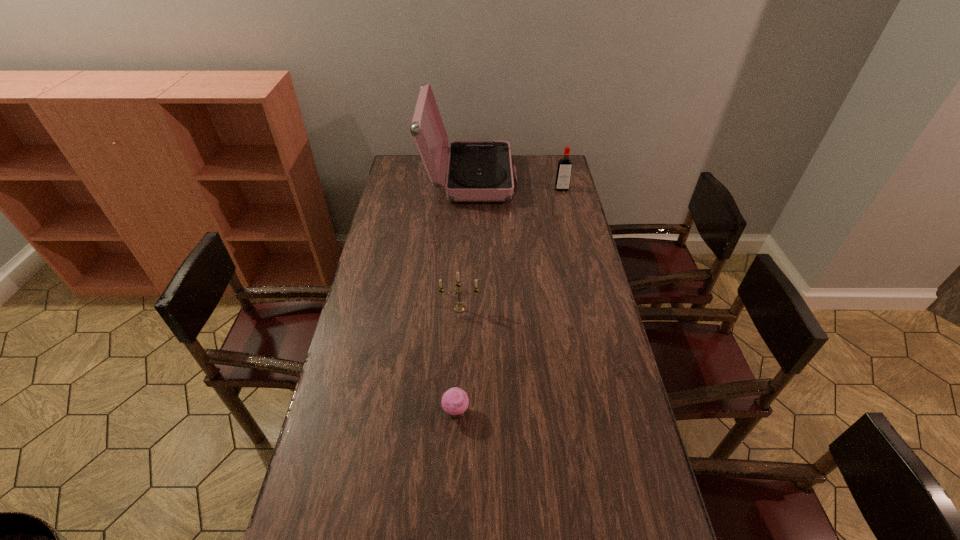
Identify the location of the tallest object. Image resolution: width=960 pixels, height=540 pixels. (478, 171).

Where is `the rightmost object`? This screenshot has height=540, width=960. the rightmost object is located at coordinates (564, 169).

At what (x,y) coordinates should I click in order to perform the action: click on vodka. Please return your answer as a coordinate pair (x, y). The image size is (960, 540). Looking at the image, I should click on (564, 169).

Identify the location of the third tallest object. The height and width of the screenshot is (540, 960). (459, 308).

Locate an element on the screen. candle is located at coordinates (459, 308).

Find the location of a particular element. Image resolution: width=960 pixels, height=540 pixels. the fourth tallest object is located at coordinates (455, 401).

This screenshot has width=960, height=540. What are the coordinates of `cupcake` in the screenshot? It's located at (455, 401).

Find the location of a particular element. The height and width of the screenshot is (540, 960). vacant space located with the lid open on the tallest object is located at coordinates (538, 179).

You are a GUI agent. You are given a task and a screenshot of the screen. Output one action in this format:
    pyautogui.click(x=<x>, y=<y>)
    Task: Click on the free space located on the front and back of the vodka
    The width and height of the screenshot is (960, 540).
    Given the screenshot: What is the action you would take?
    click(x=572, y=234)

The image size is (960, 540). I want to click on free region located 0.160m on the back of the third nearest object, so click(x=461, y=273).